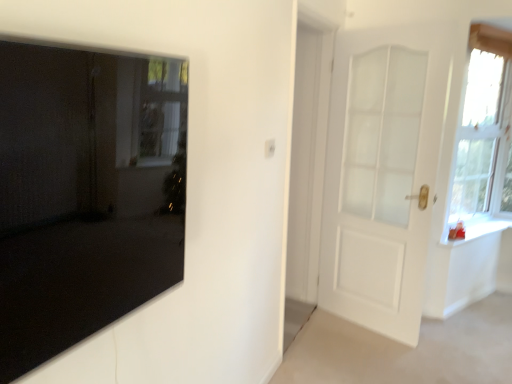
Question: Should I look upward or downward to see white glossy window sill at right?

Choices:
 (A) up
 (B) down

Answer: (B)

Question: Considering the relative positions of white glossy window sill at right and white frosted glass window at upper right in the image provided, is white glossy window sill at right to the left of white frosted glass window at upper right from the viewer's perspective?

Choices:
 (A) no
 (B) yes

Answer: (B)

Question: From the image's perspective, would you say white glossy window sill at right is shown under white frosted glass window at upper right?

Choices:
 (A) no
 (B) yes

Answer: (B)

Question: Can you confirm if white glossy window sill at right is smaller than white frosted glass window at upper right?

Choices:
 (A) yes
 (B) no

Answer: (A)

Question: From a real-world perspective, is white glossy window sill at right located beneath white frosted glass window at upper right?

Choices:
 (A) yes
 (B) no

Answer: (A)

Question: Does white glossy window sill at right touch white frosted glass window at upper right?

Choices:
 (A) no
 (B) yes

Answer: (A)

Question: Is white glossy window sill at right bigger than white frosted glass window at upper right?

Choices:
 (A) yes
 (B) no

Answer: (B)

Question: From the image's perspective, is white frosted glass window at upper right beneath white glossy window sill at right?

Choices:
 (A) yes
 (B) no

Answer: (B)

Question: Is white frosted glass window at upper right not within white glossy window sill at right?

Choices:
 (A) yes
 (B) no

Answer: (A)

Question: Is white frosted glass window at upper right closer to the viewer compared to white glossy window sill at right?

Choices:
 (A) yes
 (B) no

Answer: (A)

Question: Does white frosted glass window at upper right have a larger size compared to white glossy window sill at right?

Choices:
 (A) yes
 (B) no

Answer: (A)

Question: Considering the relative sizes of white frosted glass window at upper right and white glossy window sill at right in the image provided, is white frosted glass window at upper right smaller than white glossy window sill at right?

Choices:
 (A) yes
 (B) no

Answer: (B)

Question: Is white frosted glass window at upper right next to white glossy window sill at right and touching it?

Choices:
 (A) yes
 (B) no

Answer: (B)

Question: Considering the relative sizes of matte black mirror at left, which ranks as the 2th door in right-to-left order, and white glossy window sill at right in the image provided, is matte black mirror at left, which ranks as the 2th door in right-to-left order, taller than white glossy window sill at right?

Choices:
 (A) yes
 (B) no

Answer: (A)